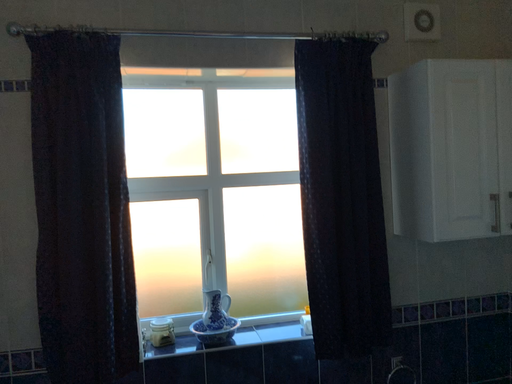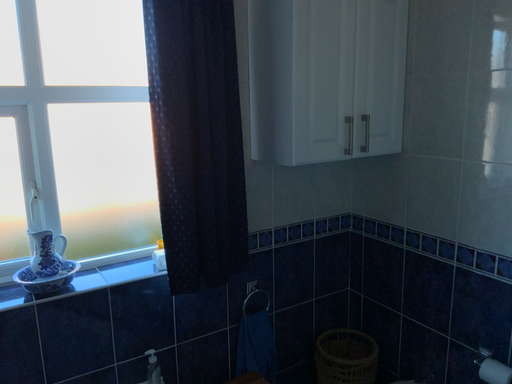
Question: Which way did the camera rotate in the video?

Choices:
 (A) rotated downward
 (B) rotated upward

Answer: (A)